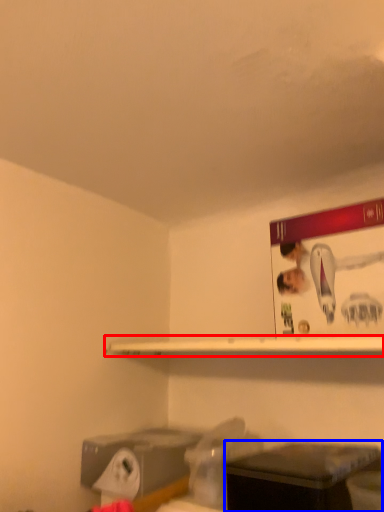
Question: Which point is closer to the camera, shelf (highlighted by a red box) or furniture (highlighted by a blue box)?

Choices:
 (A) shelf
 (B) furniture

Answer: (B)